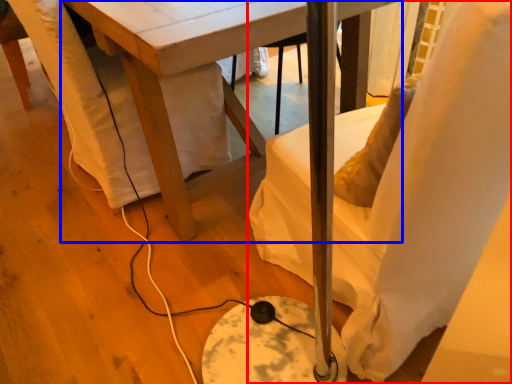
Question: Which of the following is the farthest to the observer, chair (highlighted by a red box) or table (highlighted by a blue box)?

Choices:
 (A) chair
 (B) table

Answer: (B)